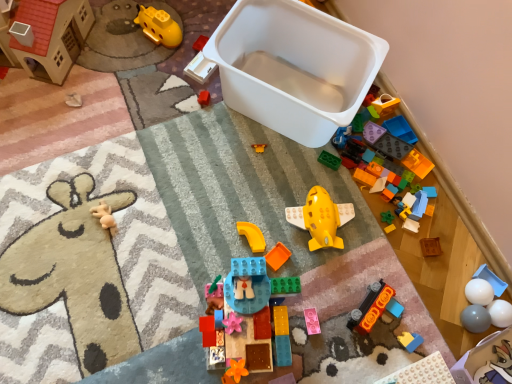
I want to click on empty space that is in between white plastic storage box at upper center, the 2th storage box in the right-to-left sequence, and orange matte car at lower right, marked as the 9th toy in a left-to-right arrangement, so click(x=308, y=193).